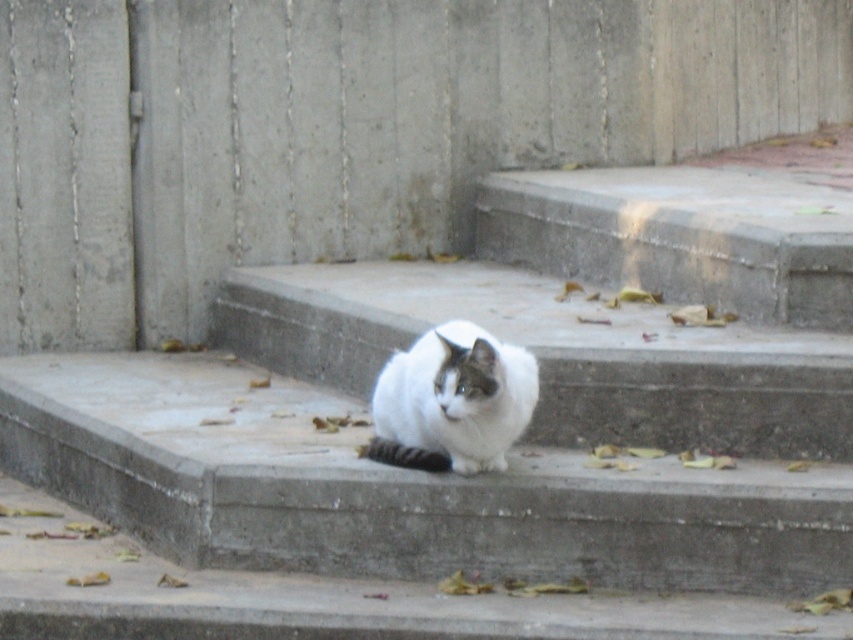
You are a delivery robot that needs to deliver a package to the front door. You are currently positioned at the bottom of the concrete stairs at center. The white fluffy cat at center is blocking your path. Can you safely navigate around the cat to reach the front door without disturbing it?

The concrete stairs at center is 19.40 inches away from the white fluffy cat at center. Since the distance between them is sufficient, you can safely navigate around the cat by moving either to the left or right side of the white fluffy cat at center to reach the front door without disturbing it.

You are standing at the base of the concrete stairs at center and want to take a photo of them with your camera. The camera requires you to be at least 4 meters away to capture the entire staircase in one frame. Can you do it?

The concrete stairs at center and camera are 4.39 meters apart, so yes, you can capture the entire staircase in one frame since the distance is sufficient.

You are a photographer trying to capture the white fluffy cat at center sitting on the concrete stairs at center. If you want to ensure the cat fits entirely in your photo without cropping, which object should you focus on to frame the shot properly?

The concrete stairs at center is taller than the white fluffy cat at center, so you should focus on framing the shot around the concrete stairs at center to ensure the cat fits entirely without cropping.